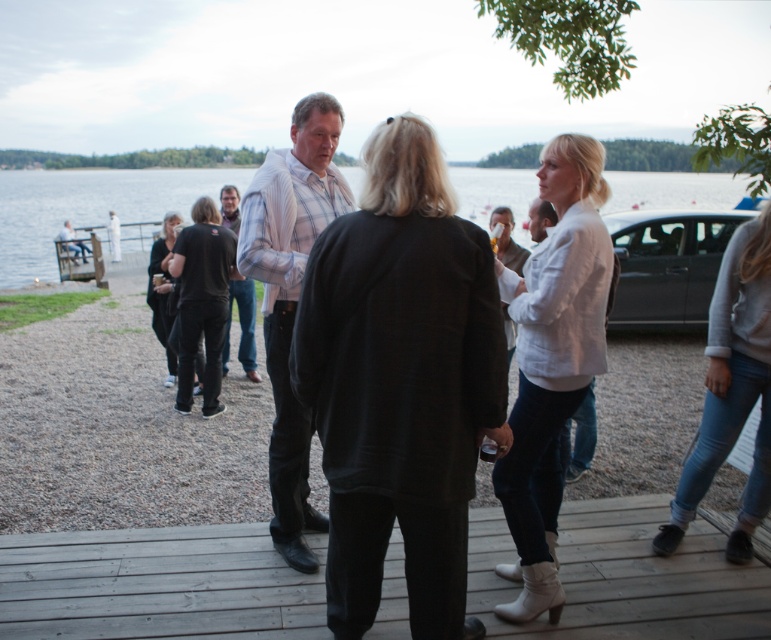
You are a photographer trying to capture a photo of the black wool coat at center and the wooden at center. If you need to maintain a minimum distance of 3 feet between your camera and the objects to get a clear shot, will you be able to position yourself appropriately?

The distance between the black wool coat at center and the wooden at center is 3.83 feet, which is greater than the required 3 feet. Therefore, you can position yourself appropriately to capture the photo.

Looking at this image, you are a photographer trying to capture a candid shot of the black wool coat at center and the wooden at center. To ensure both are in frame, should you position yourself to the left or right of the two objects?

You should position yourself to the left of the black wool coat at center and the wooden at center because the black wool coat at center is to the right of wooden at center, so placing yourself to the left would allow both objects to be captured within the frame.

You are standing on the wooden deck at the lakeside gathering. There are two points marked in the scene, one at coordinates point (485, 426) and the other at point (126, 540). Which of these points is nearer to you as you stand on the deck?

Point (485, 426) is closer to the viewer than point (126, 540), so the point at coordinates point (485, 426) is nearer to you as you stand on the deck.